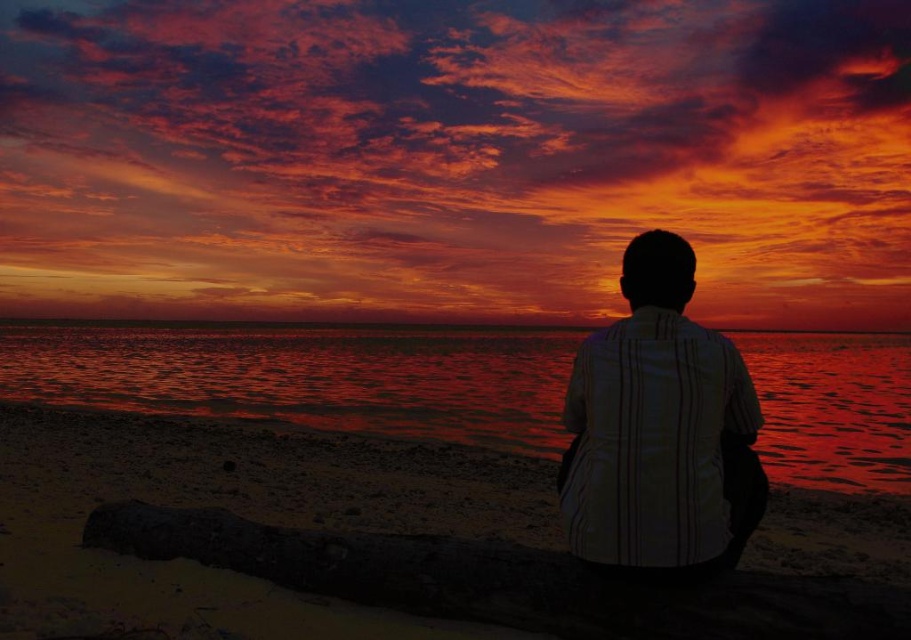
Question: Is smooth sand beach at lower center wider than white striped shirt at center?

Choices:
 (A) no
 (B) yes

Answer: (B)

Question: Which object is positioned closest to the smooth sand beach at lower center?

Choices:
 (A) white striped shirt at center
 (B) smooth water at center

Answer: (A)

Question: Where is smooth sand beach at lower center located in relation to smooth water at center in the image?

Choices:
 (A) left
 (B) right

Answer: (A)

Question: Does smooth sand beach at lower center have a lesser width compared to white striped shirt at center?

Choices:
 (A) no
 (B) yes

Answer: (A)

Question: Which object appears farthest from the camera in this image?

Choices:
 (A) smooth water at center
 (B) smooth sand beach at lower center
 (C) white striped shirt at center

Answer: (A)

Question: Estimate the real-world distances between objects in this image. Which object is closer to the white striped shirt at center?

Choices:
 (A) smooth sand beach at lower center
 (B) smooth water at center

Answer: (A)